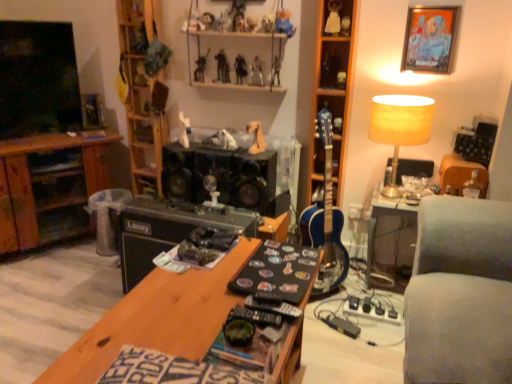
Question: Can you confirm if clear plastic trash bin at center is positioned to the left of white plush dog at center, marked as the 12th toy in a right-to-left arrangement?

Choices:
 (A) yes
 (B) no

Answer: (A)

Question: Is clear plastic trash bin at center touching white plush dog at center, the 5th toy in the left-to-right sequence?

Choices:
 (A) no
 (B) yes

Answer: (A)

Question: Is clear plastic trash bin at center located outside white plush dog at center, marked as the 12th toy in a right-to-left arrangement?

Choices:
 (A) yes
 (B) no

Answer: (A)

Question: Is clear plastic trash bin at center smaller than white plush dog at center, the 5th toy in the left-to-right sequence?

Choices:
 (A) yes
 (B) no

Answer: (B)

Question: Does clear plastic trash bin at center have a larger size compared to white plush dog at center, marked as the 12th toy in a right-to-left arrangement?

Choices:
 (A) yes
 (B) no

Answer: (A)

Question: Is white plush dog at center, marked as the 12th toy in a right-to-left arrangement, at the back of clear plastic trash bin at center?

Choices:
 (A) yes
 (B) no

Answer: (B)

Question: Considering the relative positions of metallic silver action figure at upper center, which is counted as the ninth toy, starting from the right, and metallic silver action figure at upper center, which is the fifth toy in right-to-left order, in the image provided, is metallic silver action figure at upper center, which is counted as the ninth toy, starting from the right, in front of metallic silver action figure at upper center, which is the fifth toy in right-to-left order,?

Choices:
 (A) yes
 (B) no

Answer: (B)

Question: Considering the relative positions of metallic silver action figure at upper center, which ranks as the 8th toy in left-to-right order, and metallic silver action figure at upper center, which is the fifth toy in right-to-left order, in the image provided, is metallic silver action figure at upper center, which ranks as the 8th toy in left-to-right order, behind metallic silver action figure at upper center, which is the fifth toy in right-to-left order,?

Choices:
 (A) yes
 (B) no

Answer: (A)

Question: Is metallic silver action figure at upper center, which is counted as the ninth toy, starting from the right, completely or partially outside of metallic silver action figure at upper center, the twelfth toy viewed from the left?

Choices:
 (A) yes
 (B) no

Answer: (A)

Question: Is metallic silver action figure at upper center, which is counted as the ninth toy, starting from the right, facing towards metallic silver action figure at upper center, the twelfth toy viewed from the left?

Choices:
 (A) no
 (B) yes

Answer: (A)

Question: Is metallic silver action figure at upper center, which ranks as the 8th toy in left-to-right order, surrounding metallic silver action figure at upper center, which is the fifth toy in right-to-left order?

Choices:
 (A) yes
 (B) no

Answer: (B)

Question: From a real-world perspective, is metallic silver action figure at upper center, which ranks as the 8th toy in left-to-right order, under metallic silver action figure at upper center, the twelfth toy viewed from the left?

Choices:
 (A) yes
 (B) no

Answer: (A)

Question: Does shiny plastic action figure at upper center, placed as the tenth toy when sorted from right to left, have a lesser width compared to metallic figure at upper center, the 11th toy from the right?

Choices:
 (A) yes
 (B) no

Answer: (A)